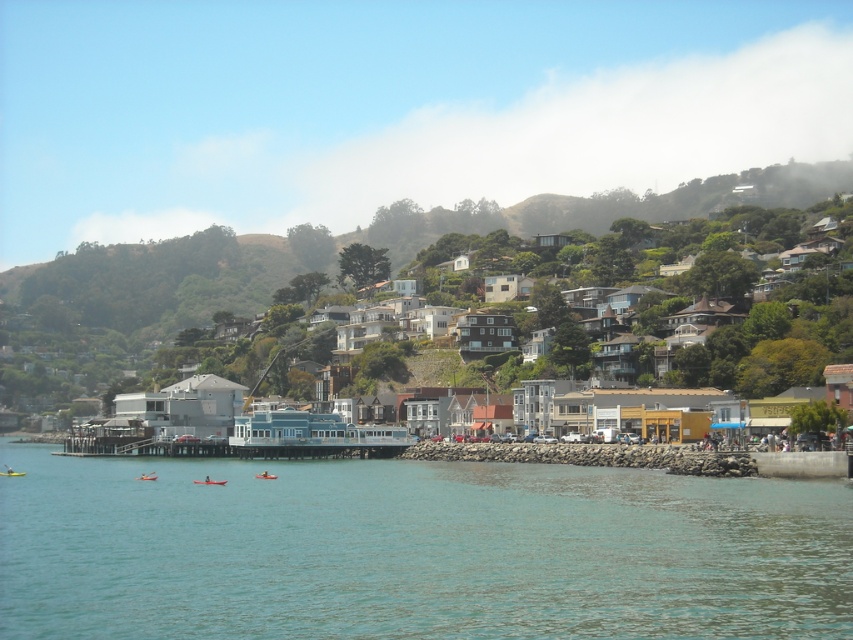
Question: Is orange kayak at center behind orange kayak at lower left?

Choices:
 (A) no
 (B) yes

Answer: (A)

Question: Which point appears closest to the camera in this image?

Choices:
 (A) (271, 476)
 (B) (28, 356)
 (C) (212, 484)
 (D) (9, 474)

Answer: (C)

Question: Can you confirm if orange kayak at center is positioned to the left of orange kayak at lower left?

Choices:
 (A) no
 (B) yes

Answer: (A)

Question: Can you confirm if orange kayak at lower left is positioned above yellow plastic kayak at lower left?

Choices:
 (A) yes
 (B) no

Answer: (A)

Question: Among these points, which one is farthest from the camera?

Choices:
 (A) (12, 476)
 (B) (136, 477)
 (C) (662, 570)
 (D) (207, 483)

Answer: (A)

Question: Which object is positioned farthest from the orange kayak at lower left?

Choices:
 (A) yellow plastic kayak at lower left
 (B) clear blue water at center
 (C) orange kayak at center
 (D) orange plastic kayak at center

Answer: (B)